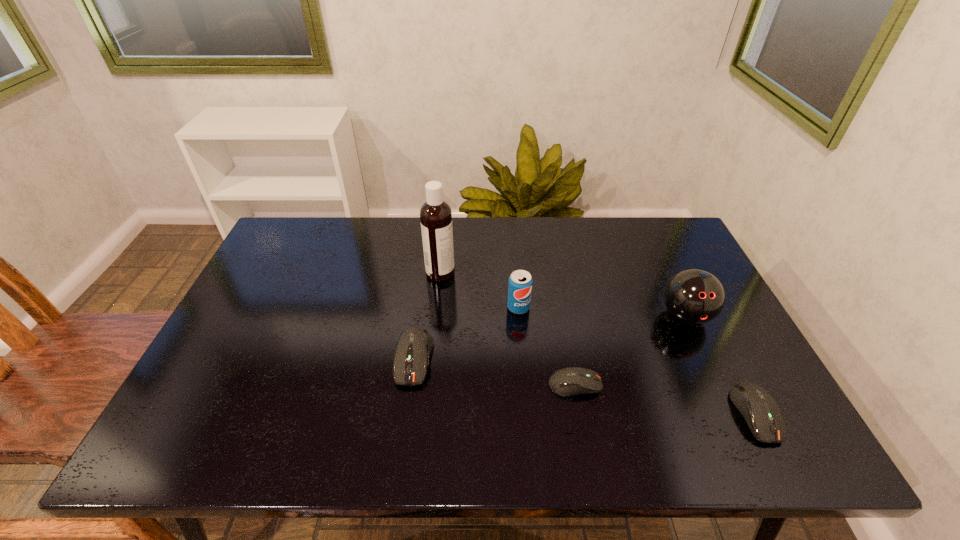
Locate an element on the screen. The width and height of the screenshot is (960, 540). vacant area between the bowling ball and the leftmost computer equipment is located at coordinates (549, 338).

Identify the location of free space between the farthest object and the fifth shortest object. This screenshot has height=540, width=960. (563, 294).

The image size is (960, 540). I want to click on empty location between the soda can and the leftmost computer equipment, so click(x=466, y=333).

What are the coordinates of `vacant point located between the dishwasher detergent and the shortest object` in the screenshot? It's located at pyautogui.click(x=508, y=329).

Choose which object is the nearest neighbor to the second computer equipment from right to left. Please provide its 2D coordinates. Your answer should be formatted as a tuple, i.e. [(x, y)], where the tuple contains the x and y coordinates of a point satisfying the conditions above.

[(520, 281)]

Identify which object is the nearest to the rightmost computer equipment. Please provide its 2D coordinates. Your answer should be formatted as a tuple, i.e. [(x, y)], where the tuple contains the x and y coordinates of a point satisfying the conditions above.

[(693, 296)]

Locate an element on the screen. computer equipment that can be found as the second closest to the rightmost computer equipment is located at coordinates (413, 347).

Select which computer equipment appears as the second closest to the bowling ball. Please provide its 2D coordinates. Your answer should be formatted as a tuple, i.e. [(x, y)], where the tuple contains the x and y coordinates of a point satisfying the conditions above.

[(570, 381)]

Locate an element on the screen. This screenshot has width=960, height=540. vacant space that satisfies the following two spatial constraints: 1. on the surface of the bowling ball near the finger holes; 2. on the button of the shortest computer equipment is located at coordinates (717, 384).

What are the coordinates of `free space that satisfies the following two spatial constraints: 1. on the surface of the bowling ball near the finger holes; 2. on the button of the shortest object` in the screenshot? It's located at (717, 384).